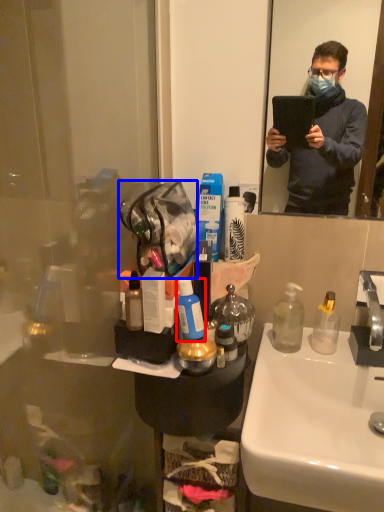
Question: Which object is further to the camera taking this photo, toiletries (highlighted by a red box) or handbag (highlighted by a blue box)?

Choices:
 (A) toiletries
 (B) handbag

Answer: (A)